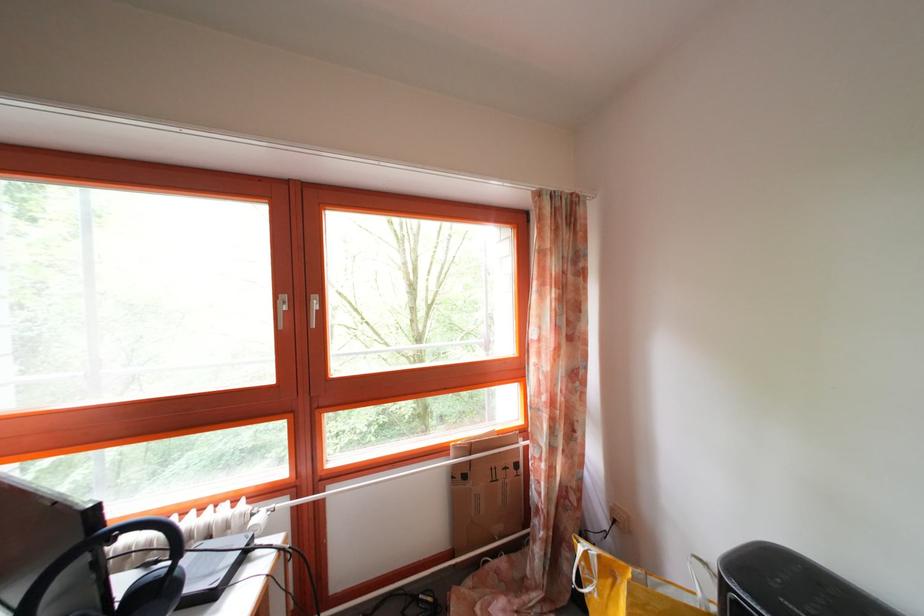
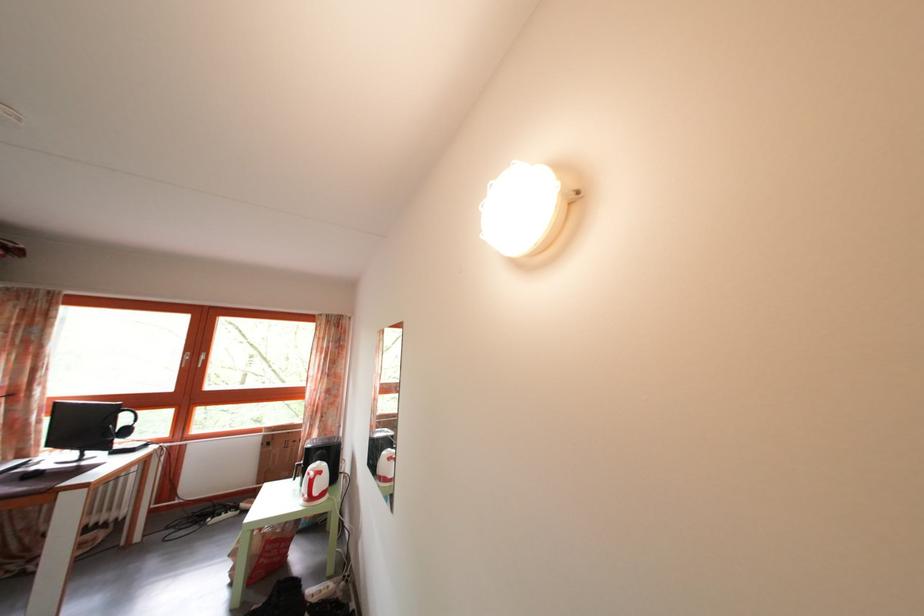
Which direction would the cameraman need to move to produce the second image?

The cameraman moved toward right, backward.